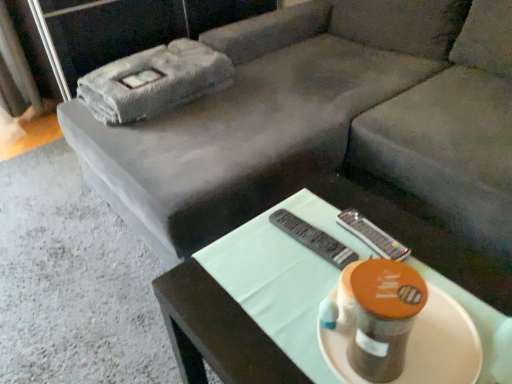
At what (x,y) coordinates should I click in order to perform the action: click on empty space that is to the right of black plastic remote at center. Please return your answer as a coordinate pair (x, y). The image size is (512, 384). Looking at the image, I should click on (381, 233).